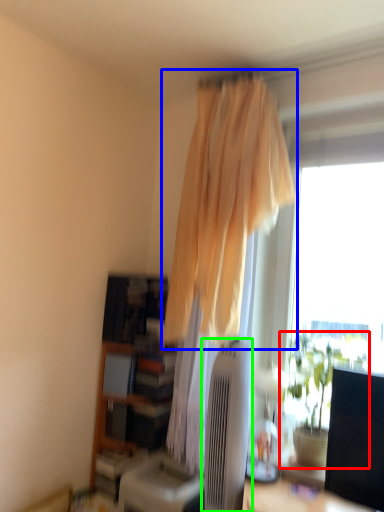
Question: Which object is the farthest from houseplant (highlighted by a red box)? Choose among these: curtain (highlighted by a blue box) or air conditioner (highlighted by a green box).

Choices:
 (A) curtain
 (B) air conditioner

Answer: (A)